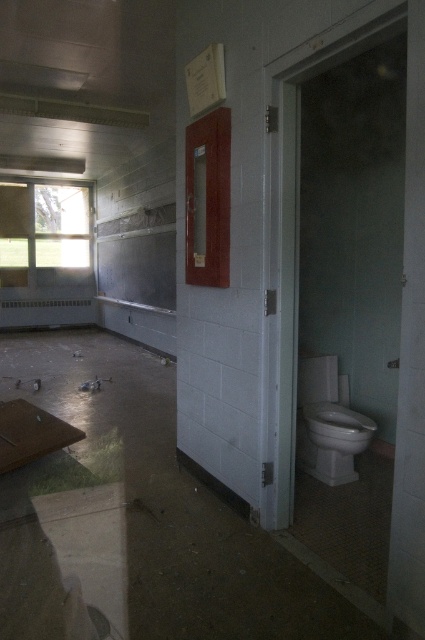
You are a maintenance worker inspecting the bathroom. You need to check both the wooden frame at upper center and the white glossy toilet at lower right. Which object is located higher up in the room?

The wooden frame at upper center is positioned over the white glossy toilet at lower right, so it is higher up in the room.

You are standing in the abandoned bathroom and want to locate the wooden frame at upper center. According to the coordinates given, where should you look?

The wooden frame at upper center is located at coordinates point (207, 198).